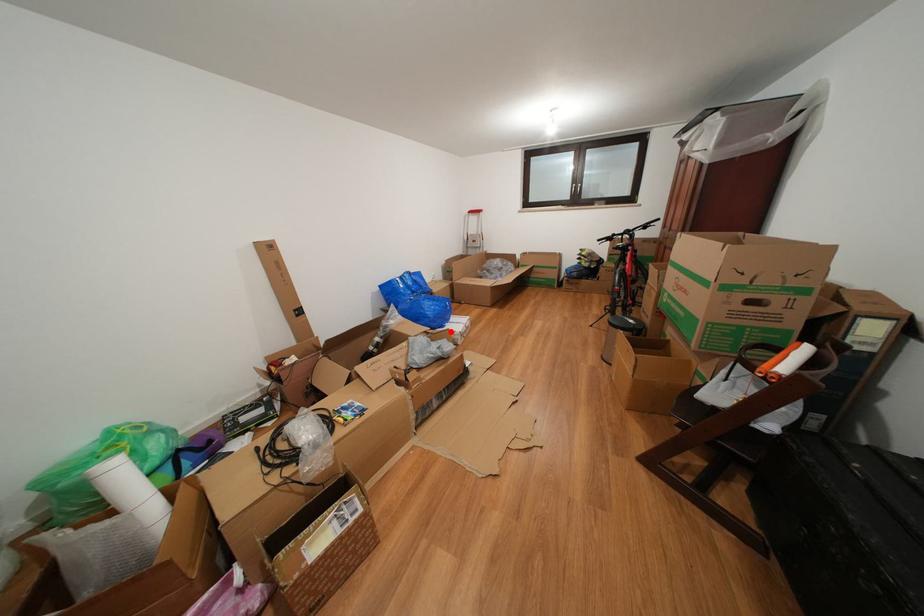
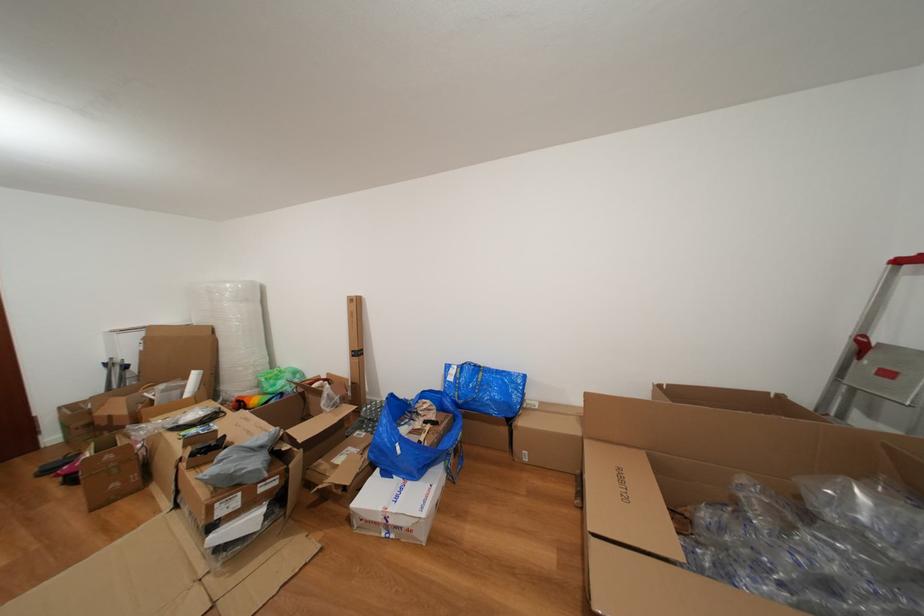
Question: A red point is marked in image1. In image2, is the corresponding 3D point closer to the camera or farther? Reply with the corresponding letter.

Choices:
 (A) The corresponding 3D point is closer.
 (B) The corresponding 3D point is farther.

Answer: (B)